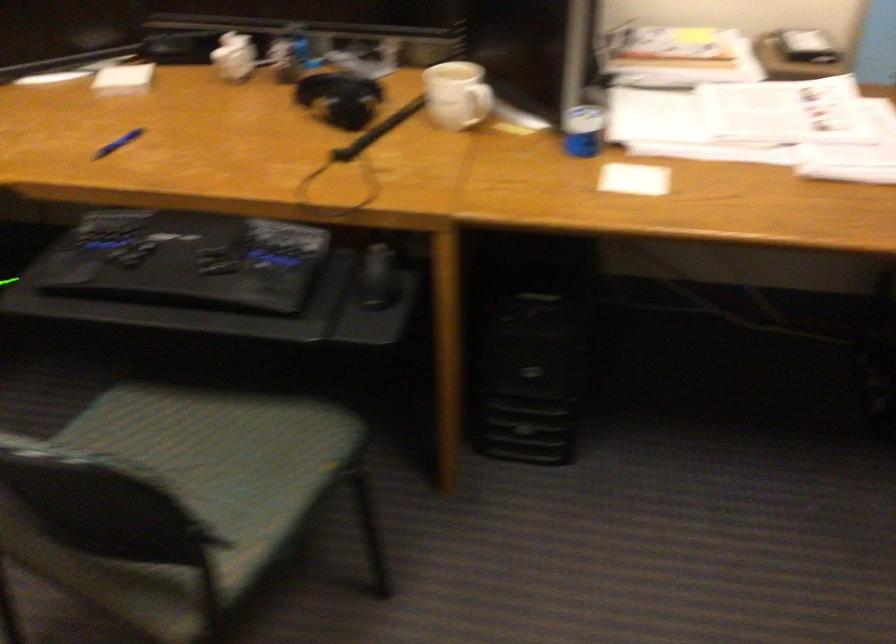
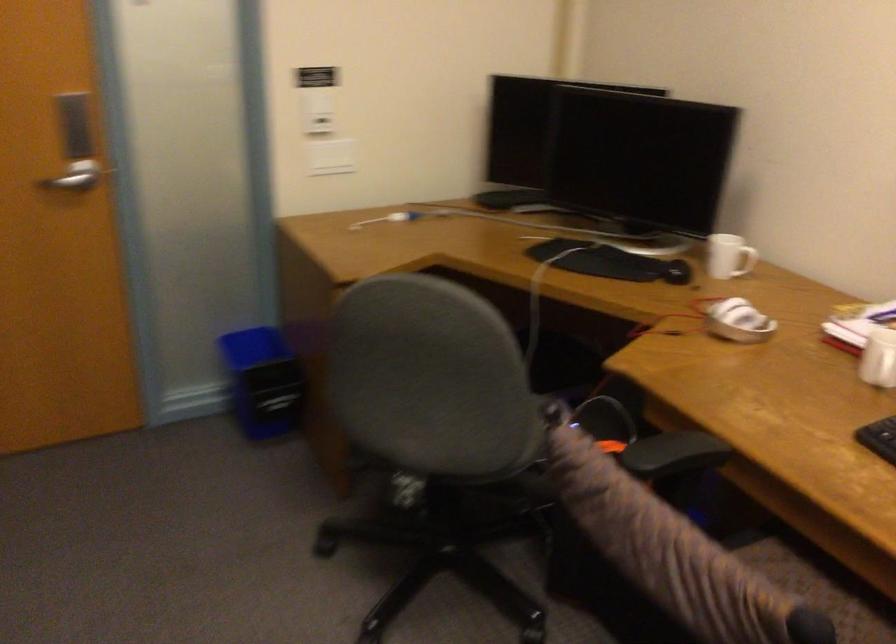
Question: How did the camera likely rotate?

Choices:
 (A) Left
 (B) Right
 (C) Up
 (D) Down

Answer: (A)